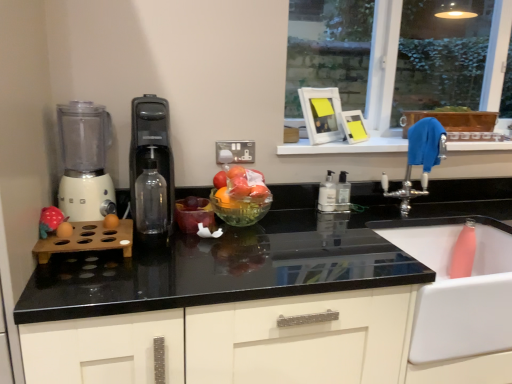
Question: From a real-world perspective, does silver metallic faucet at upper right sit lower than transparent glass bottle at center, marked as the 1th bottle in a left-to-right arrangement?

Choices:
 (A) no
 (B) yes

Answer: (A)

Question: Is silver metallic faucet at upper right thinner than transparent glass bottle at center, arranged as the 3th bottle when viewed from the right?

Choices:
 (A) yes
 (B) no

Answer: (B)

Question: Would you consider silver metallic faucet at upper right to be distant from transparent glass bottle at center, positioned as the 3th bottle in back-to-front order?

Choices:
 (A) yes
 (B) no

Answer: (B)

Question: Is the surface of silver metallic faucet at upper right in direct contact with transparent glass bottle at center, arranged as the 3th bottle when viewed from the right?

Choices:
 (A) yes
 (B) no

Answer: (B)

Question: Can we say silver metallic faucet at upper right lies outside transparent glass bottle at center, arranged as the 3th bottle when viewed from the right?

Choices:
 (A) no
 (B) yes

Answer: (B)

Question: Considering the relative sizes of silver metallic faucet at upper right and transparent glass bottle at center, which appears as the first bottle when viewed from the front, in the image provided, is silver metallic faucet at upper right bigger than transparent glass bottle at center, which appears as the first bottle when viewed from the front,?

Choices:
 (A) no
 (B) yes

Answer: (B)

Question: Does black plastic water dispenser at center have a lesser height compared to white plastic pump bottle at center, the 2th bottle when ordered from right to left?

Choices:
 (A) no
 (B) yes

Answer: (A)

Question: Does black plastic water dispenser at center have a greater width compared to white plastic pump bottle at center, placed as the 2th bottle when sorted from back to front?

Choices:
 (A) yes
 (B) no

Answer: (A)

Question: Can you confirm if black plastic water dispenser at center is taller than white plastic pump bottle at center, which is the second bottle from left to right?

Choices:
 (A) no
 (B) yes

Answer: (B)

Question: Can white plastic pump bottle at center, which is the second bottle from left to right, be found inside black plastic water dispenser at center?

Choices:
 (A) no
 (B) yes

Answer: (A)

Question: From a real-world perspective, is black plastic water dispenser at center below white plastic pump bottle at center, the second bottle viewed from the front?

Choices:
 (A) yes
 (B) no

Answer: (B)

Question: From a real-world perspective, is black plastic water dispenser at center located higher than white plastic pump bottle at center, the second bottle viewed from the front?

Choices:
 (A) yes
 (B) no

Answer: (A)

Question: Is matte pink plush toy at left smaller than translucent plastic bowl at center?

Choices:
 (A) no
 (B) yes

Answer: (B)